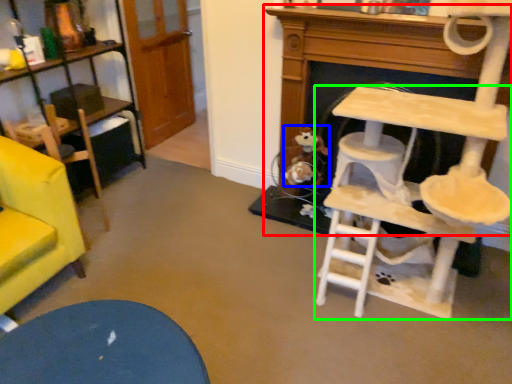
Question: Considering the real-world distances, which object is closest to fireplace (highlighted by a red box)? toy (highlighted by a blue box) or table (highlighted by a green box).

Choices:
 (A) toy
 (B) table

Answer: (A)